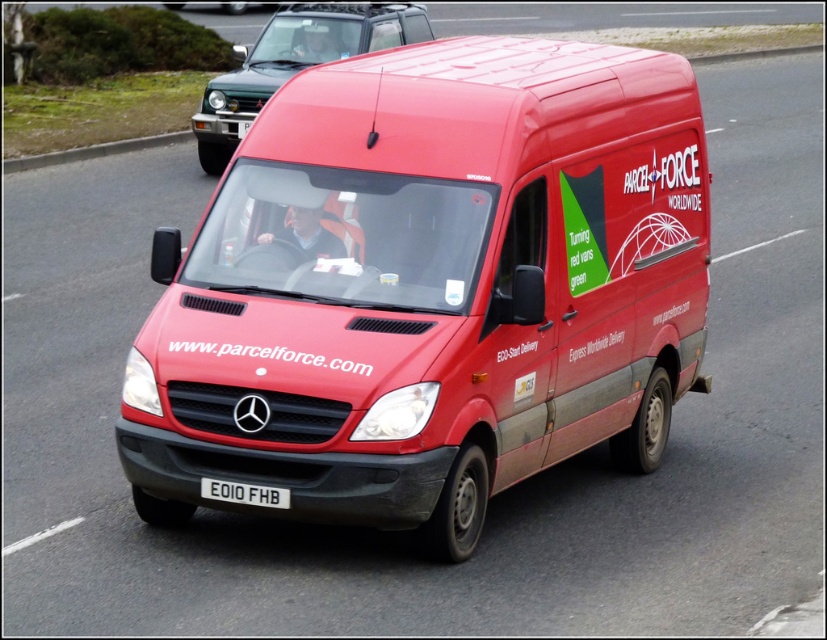
You are a traffic officer observing a road scene. You notice a matte red van at center and a metallic green suv at upper left. Which vehicle is bigger in size?

The matte red van at center is larger in size than the metallic green suv at upper left.

You are a traffic officer observing the scene. The metallic green suv at upper left and the white metallic license plate at center are both visible in your line of sight. Which object is closer to you?

The metallic green suv at upper left is closer to you because the white metallic license plate at center is behind it, indicating the SUV is in front.